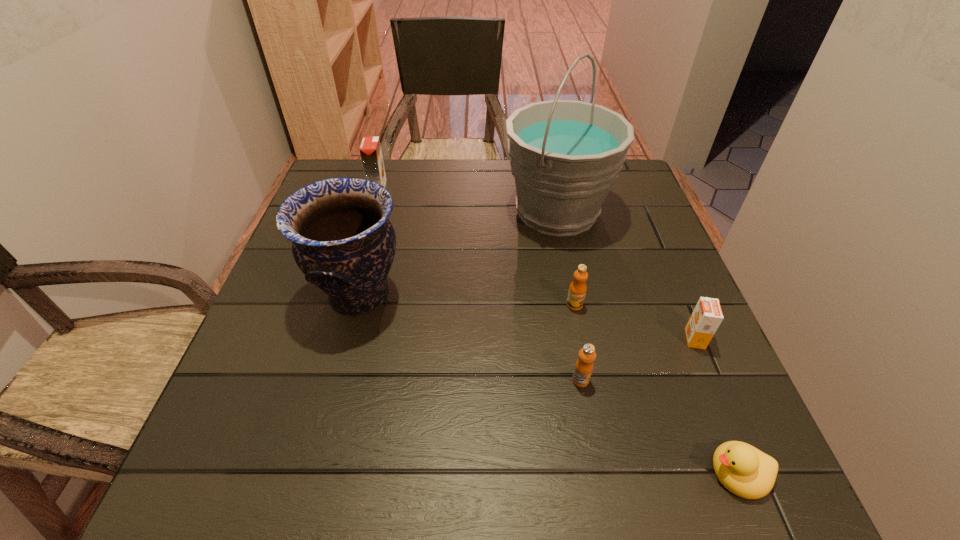
Where is `vacant space located 0.050m on the front handle of the sixth shortest object`? Image resolution: width=960 pixels, height=540 pixels. vacant space located 0.050m on the front handle of the sixth shortest object is located at coordinates pos(430,295).

Where is `blank space located on the back of the leftmost orange juice`? blank space located on the back of the leftmost orange juice is located at coordinates (383, 167).

Find the location of `free spot located on the front label of the third nearest orange juice`. free spot located on the front label of the third nearest orange juice is located at coordinates (588, 373).

At what (x,y) coordinates should I click in order to perform the action: click on vacant point located 0.200m on the left of the rightmost orange juice. Please return your answer as a coordinate pair (x, y). This screenshot has height=540, width=960. Looking at the image, I should click on (584, 339).

The height and width of the screenshot is (540, 960). What are the coordinates of `blank space located on the front label of the nearest orange juice` in the screenshot? It's located at (588, 418).

Image resolution: width=960 pixels, height=540 pixels. Identify the location of vacant region located on the face of the duckling. (663, 472).

At what (x,y) coordinates should I click in order to perform the action: click on free space located on the face of the duckling. Please return your answer as a coordinate pair (x, y). Image resolution: width=960 pixels, height=540 pixels. Looking at the image, I should click on (530, 472).

Identify the location of vacant area situated 0.300m on the face of the duckling. This screenshot has width=960, height=540. [516, 472].

Where is `bucket located at the far edge`? This screenshot has height=540, width=960. bucket located at the far edge is located at coordinates (x=564, y=154).

Identify the location of orange juice located at the far edge. The height and width of the screenshot is (540, 960). (370, 149).